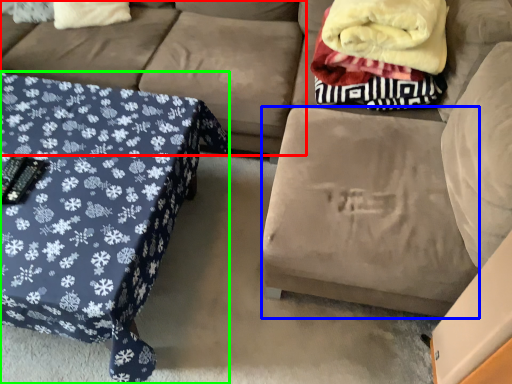
Question: Which object is the farthest from couch (highlighted by a red box)? Choose among these: footrest (highlighted by a blue box) or table (highlighted by a green box).

Choices:
 (A) footrest
 (B) table

Answer: (A)